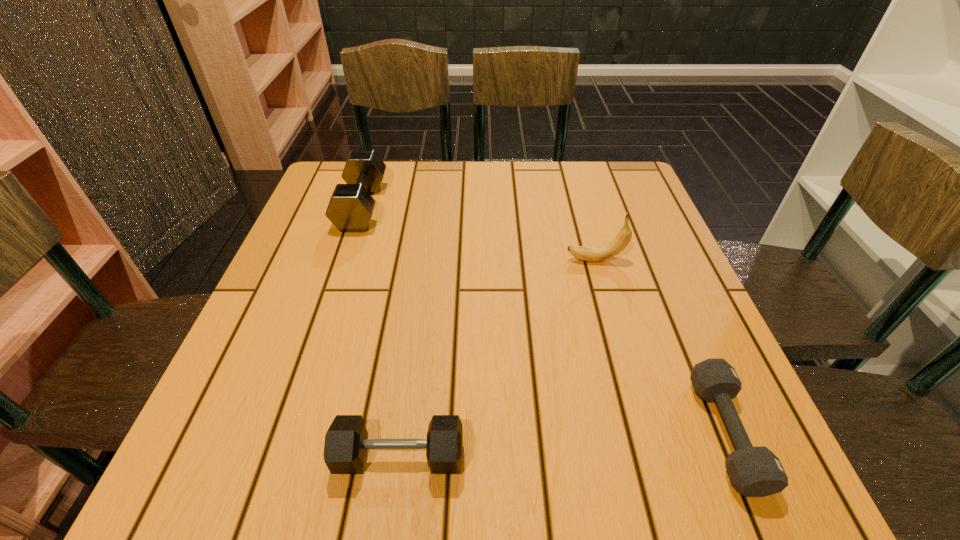
Find the location of a particular element. This screenshot has width=960, height=540. empty location between the banana and the second shortest object is located at coordinates (497, 358).

Identify the location of unoccupied position between the tallest object and the leftmost object. The height and width of the screenshot is (540, 960). (478, 233).

Identify the location of vacant area between the tallest dumbbell and the rightmost dumbbell. This screenshot has height=540, width=960. coord(543,319).

Identify the location of vacant space in between the rightmost dumbbell and the second object from right to left. This screenshot has height=540, width=960. (660, 346).

Locate an element on the screen. The width and height of the screenshot is (960, 540). free space between the leftmost dumbbell and the second dumbbell from left to right is located at coordinates (380, 331).

Where is `object that is the third nearest to the second tallest dumbbell`? object that is the third nearest to the second tallest dumbbell is located at coordinates (x=350, y=208).

This screenshot has height=540, width=960. Identify the location of the second closest object to the second shortest dumbbell. (592, 254).

You are a GUI agent. You are given a task and a screenshot of the screen. Output one action in this format:
    pyautogui.click(x=<x>, y=<y>)
    Task: Click on the closest dumbbell to the third object from right to left
    The height and width of the screenshot is (540, 960).
    Given the screenshot: What is the action you would take?
    pyautogui.click(x=756, y=471)

Locate an element on the screen. This screenshot has height=540, width=960. dumbbell that stands as the closest to the second shortest object is located at coordinates (756, 471).

The width and height of the screenshot is (960, 540). I want to click on vacant position in the image that satisfies the following two spatial constraints: 1. at the start of the peel on the banana; 2. on the front side of the second dumbbell from left to right, so click(x=651, y=456).